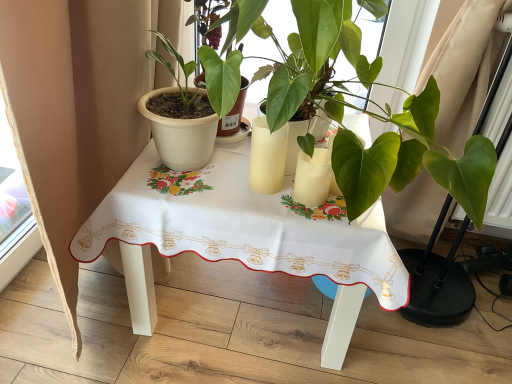
The width and height of the screenshot is (512, 384). I want to click on free space to the left of matte yellow glass at center, placed as the 1th candle holder when sorted from left to right, so click(x=195, y=177).